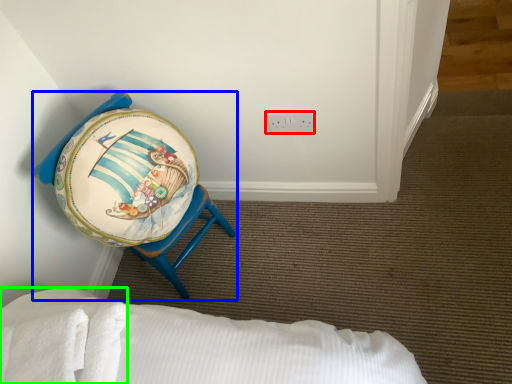
Question: Based on their relative distances, which object is farther from electric outlet (highlighted by a red box)? Choose from furniture (highlighted by a blue box) and sheet (highlighted by a green box).

Choices:
 (A) furniture
 (B) sheet

Answer: (B)